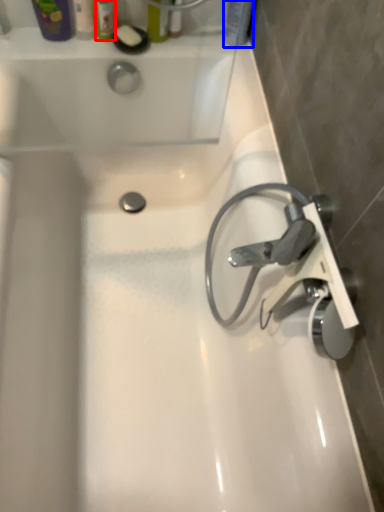
Question: Which object appears closest to the camera in this image, toiletry (highlighted by a red box) or toiletry (highlighted by a blue box)?

Choices:
 (A) toiletry
 (B) toiletry

Answer: (A)